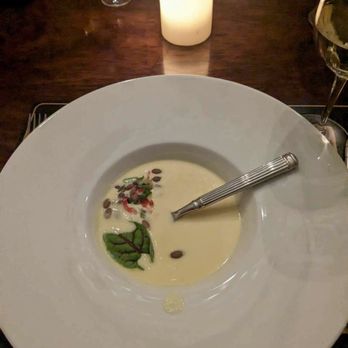
Locate an element on the screen. Image resolution: width=348 pixels, height=348 pixels. bottom of a wine glass is located at coordinates (115, 1).